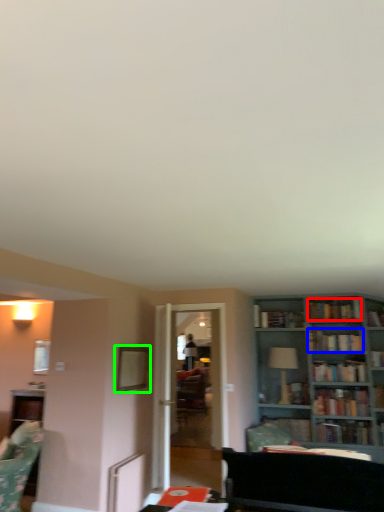
Question: Which object is the closest to the book (highlighted by a red box)? Choose among these: book (highlighted by a blue box) or picture frame (highlighted by a green box).

Choices:
 (A) book
 (B) picture frame

Answer: (A)